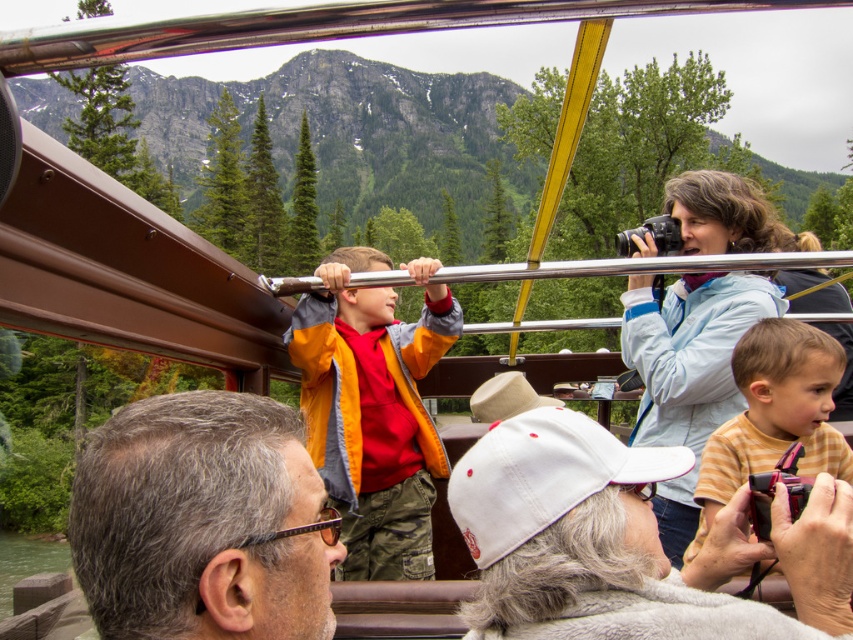
Is white cotton cap at center smaller than gray hair at center?

No, white cotton cap at center is not smaller than gray hair at center.

The width and height of the screenshot is (853, 640). Identify the location of white cotton cap at center. (627, 541).

Can you confirm if white cotton cap at center is smaller than light blue jacket at upper right?

Indeed, white cotton cap at center has a smaller size compared to light blue jacket at upper right.

Is point (770, 545) more distant than point (669, 529)?

No, (770, 545) is closer to viewer.

Describe the element at coordinates (627, 541) in the screenshot. I see `white cotton cap at center` at that location.

Identify the location of white cotton cap at center. (627, 541).

Which of these two, white cotton cap at center or yellow striped shirt at center, stands taller?

Standing taller between the two is yellow striped shirt at center.

Between white cotton cap at center and yellow striped shirt at center, which one appears on the right side from the viewer's perspective?

yellow striped shirt at center is more to the right.

You are a GUI agent. You are given a task and a screenshot of the screen. Output one action in this format:
    pyautogui.click(x=<x>, y=<y>)
    Task: Click on the white cotton cap at center
    Image resolution: width=853 pixels, height=640 pixels.
    Given the screenshot: What is the action you would take?
    pyautogui.click(x=627, y=541)